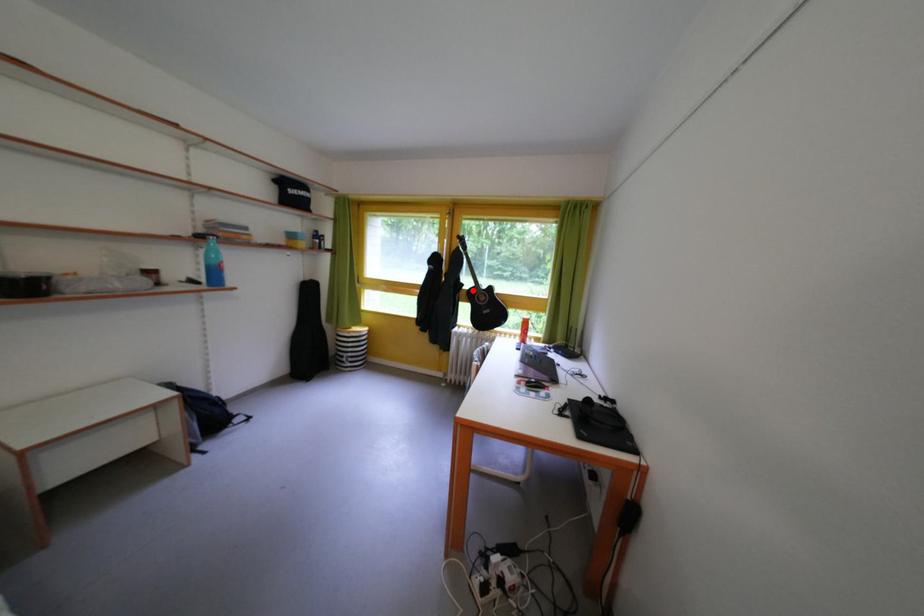
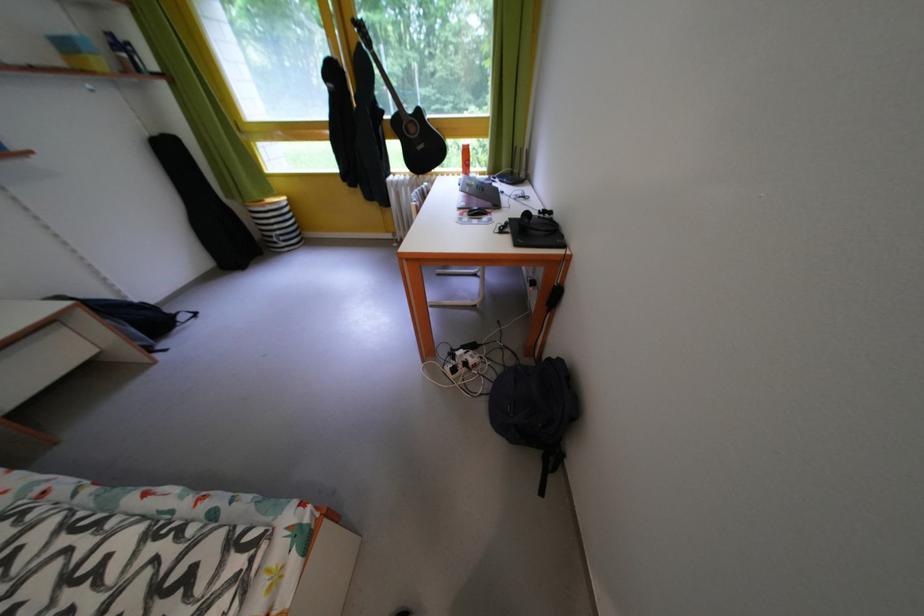
Where in the second image is the point corresponding to the highlighted location from the first image?

(393, 118)